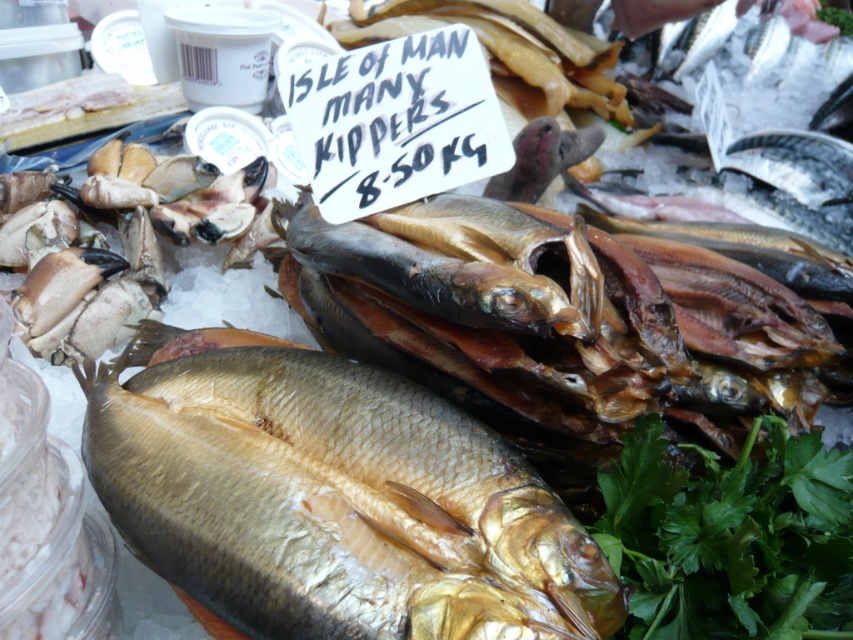
Does shiny golden fish at center have a lesser width compared to green leafy parsley at lower right?

Incorrect, shiny golden fish at center's width is not less than green leafy parsley at lower right's.

Between shiny golden fish at center and green leafy parsley at lower right, which one has less height?

green leafy parsley at lower right is shorter.

Describe the element at coordinates (335, 502) in the screenshot. I see `shiny golden fish at center` at that location.

Find the location of a particular element. shiny golden fish at center is located at coordinates (335, 502).